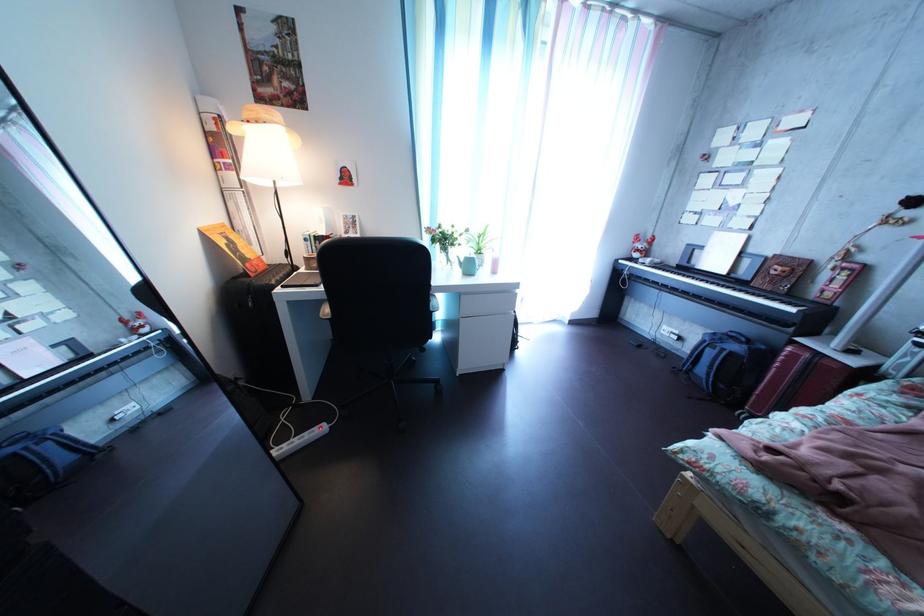
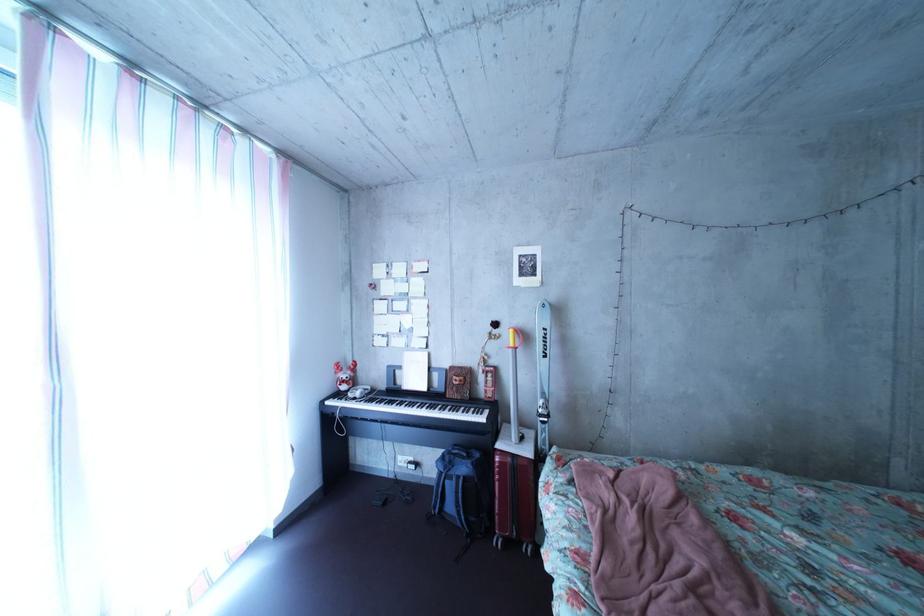
Locate, in the second image, the point that corresponds to (758,281) in the first image.

(452, 392)